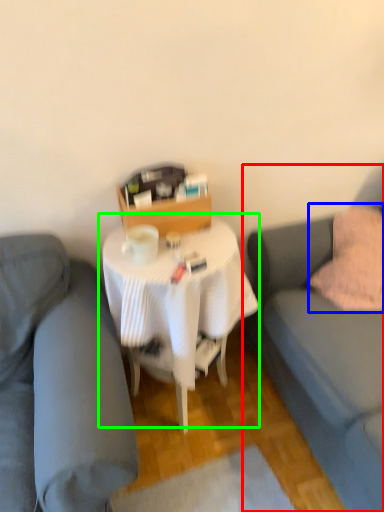
Question: Estimate the real-world distances between objects in this image. Which object is farther from studio couch (highlighted by a red box), throw pillow (highlighted by a blue box) or table (highlighted by a green box)?

Choices:
 (A) throw pillow
 (B) table

Answer: (B)